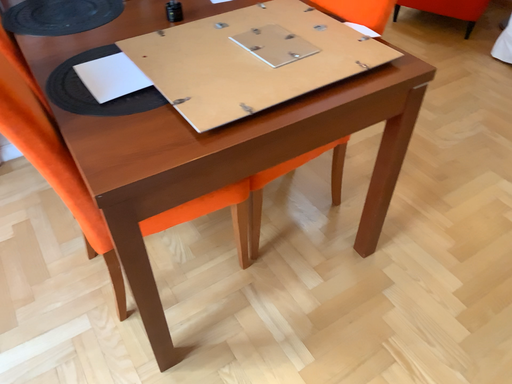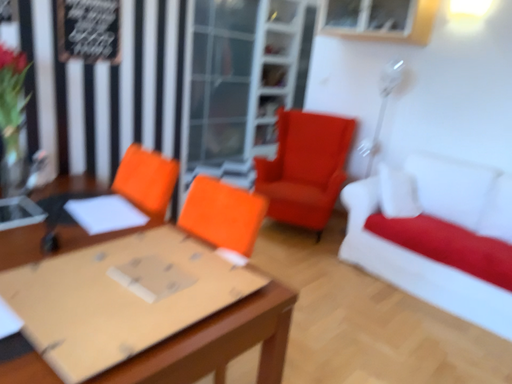
Question: Which way did the camera rotate in the video?

Choices:
 (A) rotated upward
 (B) rotated downward

Answer: (A)